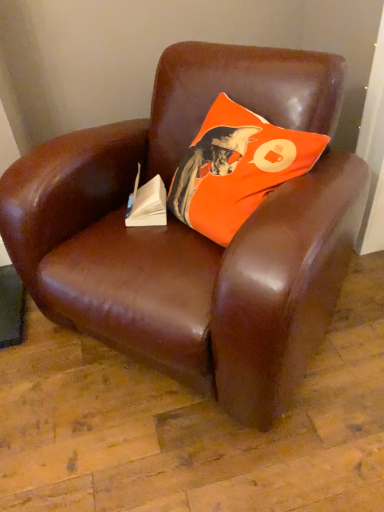
Question: Is brown leather chair at center bigger or smaller than orange fabric pillow at upper center?

Choices:
 (A) small
 (B) big

Answer: (B)

Question: From the image's perspective, is brown leather chair at center located above or below orange fabric pillow at upper center?

Choices:
 (A) above
 (B) below

Answer: (B)

Question: Which object is positioned farthest from the white paper at center?

Choices:
 (A) orange fabric pillow at upper center
 (B) brown leather chair at center

Answer: (B)

Question: Considering the real-world distances, which object is farthest from the orange fabric pillow at upper center?

Choices:
 (A) white paper at center
 (B) brown leather chair at center

Answer: (A)